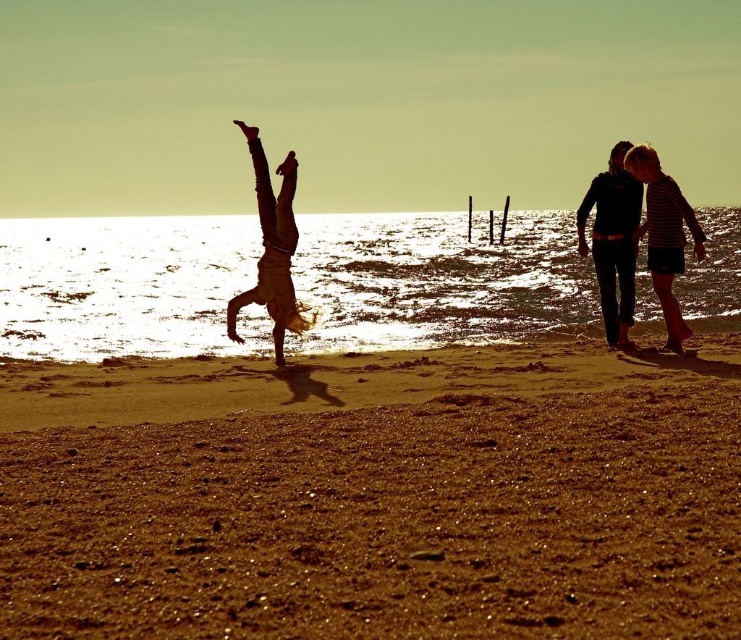
Between brown sandy beach at center and silhouette clothing at right, which one is positioned higher?

silhouette clothing at right is above.

Who is positioned more to the right, brown sandy beach at center or silhouette clothing at right?

silhouette clothing at right is more to the right.

Is point (494, 566) more distant than point (659, 234)?

No, it is in front of (659, 234).

Identify the location of brown sandy beach at center. (373, 497).

Does brown sandy beach at center have a greater height compared to silhouette figure at center?

No.

Who is lower down, brown sandy beach at center or silhouette figure at center?

brown sandy beach at center is lower down.

Who is more forward, (659, 490) or (282, 234)?

Positioned in front is point (659, 490).

Find the location of a particular element. The width and height of the screenshot is (741, 640). brown sandy beach at center is located at coordinates (373, 497).

Based on the photo, is silhouette clothing at right positioned behind silhouette figure at center?

That is False.

Is silhouette clothing at right wider than silhouette figure at center?

Indeed, silhouette clothing at right has a greater width compared to silhouette figure at center.

Is point (664, 241) closer to viewer compared to point (282, 211)?

Yes, point (664, 241) is closer to viewer.

Image resolution: width=741 pixels, height=640 pixels. What are the coordinates of `silhouette clothing at right` in the screenshot? It's located at (661, 230).